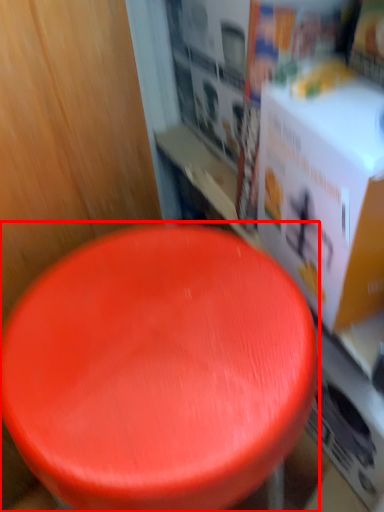
Question: In this image, where is stool (annotated by the red box) located relative to box?

Choices:
 (A) right
 (B) left

Answer: (B)